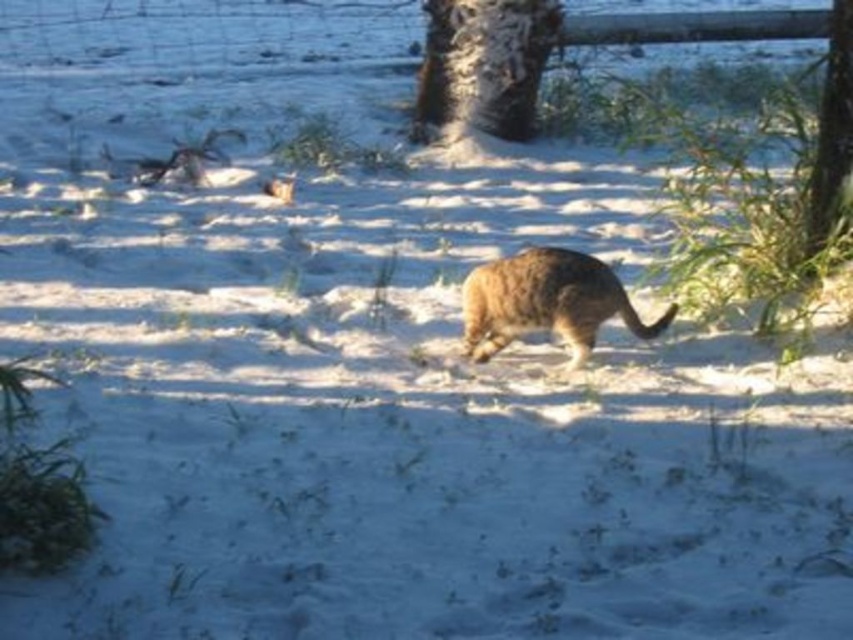
Question: Which of these objects is positioned farthest from the fuzzy brown cat at center?

Choices:
 (A) bark textured tree at upper center
 (B) brown textured tree trunk at right

Answer: (A)

Question: Can you confirm if bark textured tree at upper center is positioned below brown textured tree trunk at right?

Choices:
 (A) yes
 (B) no

Answer: (B)

Question: Does bark textured tree at upper center have a larger size compared to fuzzy brown cat at center?

Choices:
 (A) yes
 (B) no

Answer: (A)

Question: Estimate the real-world distances between objects in this image. Which object is closer to the fuzzy brown cat at center?

Choices:
 (A) brown textured tree trunk at right
 (B) bark textured tree at upper center

Answer: (A)

Question: Does bark textured tree at upper center lie in front of brown textured tree trunk at right?

Choices:
 (A) yes
 (B) no

Answer: (B)

Question: Which point is farther to the camera?

Choices:
 (A) (809, 182)
 (B) (442, 52)

Answer: (B)